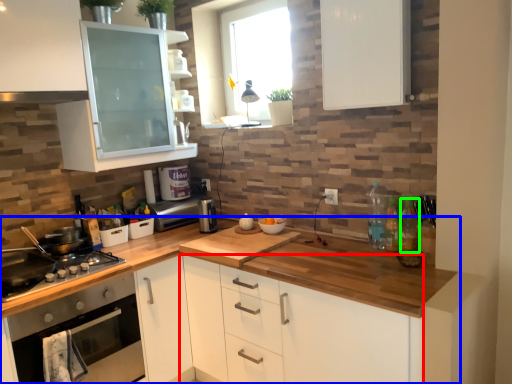
Question: Which object is the farthest from cabinetry (highlighted by a red box)? Choose among these: countertop (highlighted by a blue box) or bottle (highlighted by a green box).

Choices:
 (A) countertop
 (B) bottle

Answer: (B)